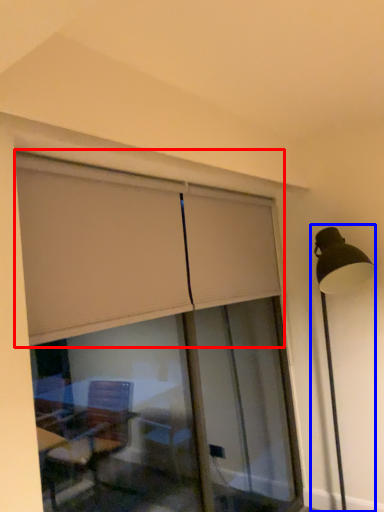
Question: Which object appears farthest to the camera in this image, curtain (highlighted by a red box) or lamp post (highlighted by a blue box)?

Choices:
 (A) curtain
 (B) lamp post

Answer: (B)